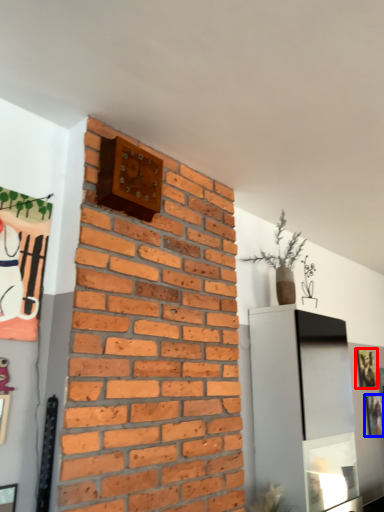
Question: Which object appears closest to the camera in this image, picture frame (highlighted by a red box) or picture frame (highlighted by a blue box)?

Choices:
 (A) picture frame
 (B) picture frame

Answer: (B)